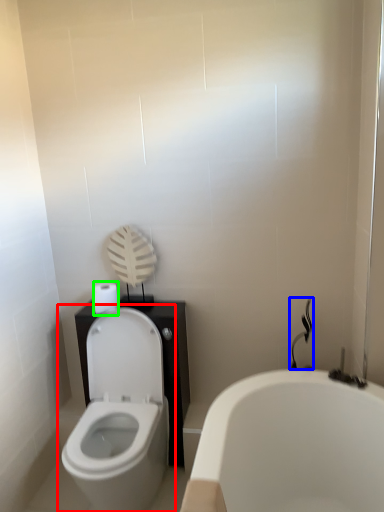
Question: Which object is the closest to the toilet (highlighted by a red box)? Choose among these: shower (highlighted by a blue box) or toilet paper (highlighted by a green box).

Choices:
 (A) shower
 (B) toilet paper

Answer: (B)